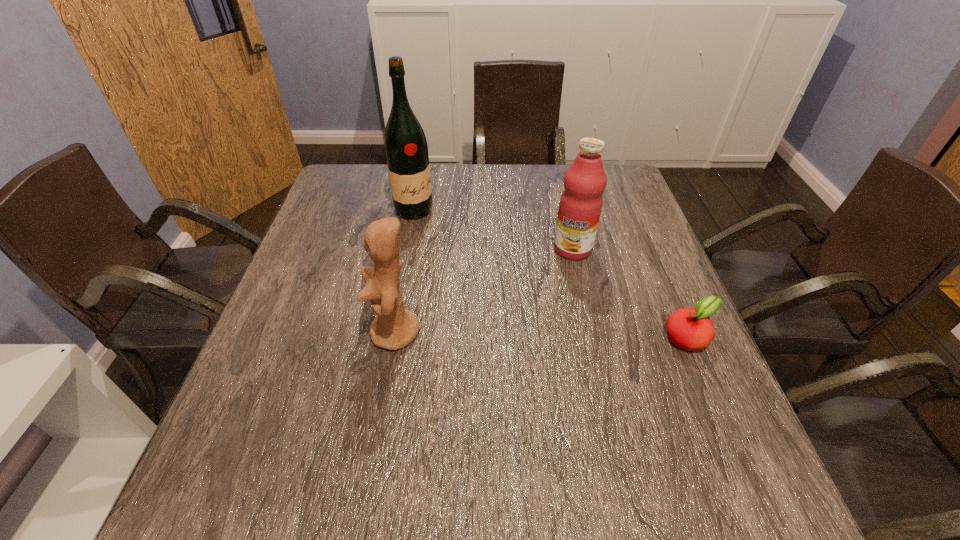
The height and width of the screenshot is (540, 960). In the image, there is a desktop. Find the location of `free region at the near edge`. free region at the near edge is located at coordinates (339, 424).

In the image, there is a desktop. Where is `vacant space at the left edge`? vacant space at the left edge is located at coordinates (347, 217).

The width and height of the screenshot is (960, 540). I want to click on vacant area at the right edge, so click(x=614, y=236).

At what (x,y) coordinates should I click in order to perform the action: click on vacant space at the far left corner. Please return your answer as a coordinate pair (x, y). Image resolution: width=960 pixels, height=540 pixels. Looking at the image, I should click on (344, 184).

Where is `vacant space in between the figurine and the fruit juice`? vacant space in between the figurine and the fruit juice is located at coordinates (484, 291).

At what (x,y) coordinates should I click in order to perform the action: click on vacant area that lies between the rightmost object and the figurine. Please return your answer as a coordinate pair (x, y). This screenshot has width=960, height=540. Looking at the image, I should click on (541, 335).

You are a GUI agent. You are given a task and a screenshot of the screen. Output one action in this format:
    pyautogui.click(x=<x>, y=<y>)
    Task: Click on the vacant area that lies between the apple and the figurine
    
    Given the screenshot: What is the action you would take?
    pyautogui.click(x=541, y=335)

I want to click on vacant area that lies between the figurine and the rightmost object, so click(x=541, y=335).

Find the location of a particular element. empty space that is in between the tallest object and the figurine is located at coordinates 404,272.

You are a GUI agent. You are given a task and a screenshot of the screen. Output one action in this format:
    pyautogui.click(x=<x>, y=<y>)
    Task: Click on the vacant point located between the figurine and the rightmost object
    
    Given the screenshot: What is the action you would take?
    tap(541, 335)